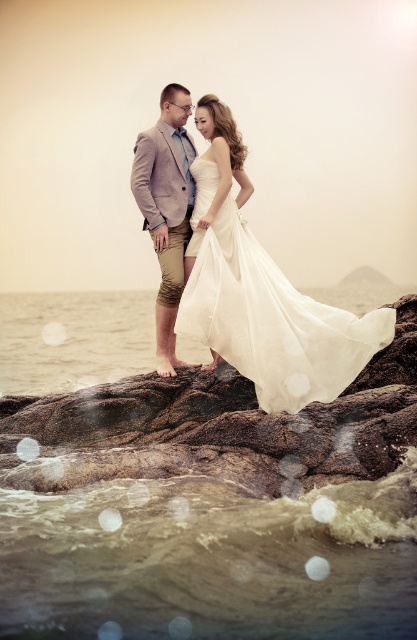
Question: Based on their relative distances, which object is nearer to the light brown textured shorts at center?

Choices:
 (A) satin white dress at center
 (B) translucent water at rock bottom

Answer: (A)

Question: Does white sheer dress at center come behind satin white dress at center?

Choices:
 (A) no
 (B) yes

Answer: (A)

Question: Is light brown textured shorts at center positioned behind satin white dress at center?

Choices:
 (A) yes
 (B) no

Answer: (B)

Question: Which point is closer to the camera?

Choices:
 (A) translucent water at rock bottom
 (B) white sheer dress at center
 (C) light brown textured shorts at center

Answer: (A)

Question: Is translucent water at rock bottom thinner than satin white dress at center?

Choices:
 (A) no
 (B) yes

Answer: (A)

Question: Which object is the farthest from the satin white dress at center?

Choices:
 (A) light brown textured shorts at center
 (B) white sheer dress at center

Answer: (B)